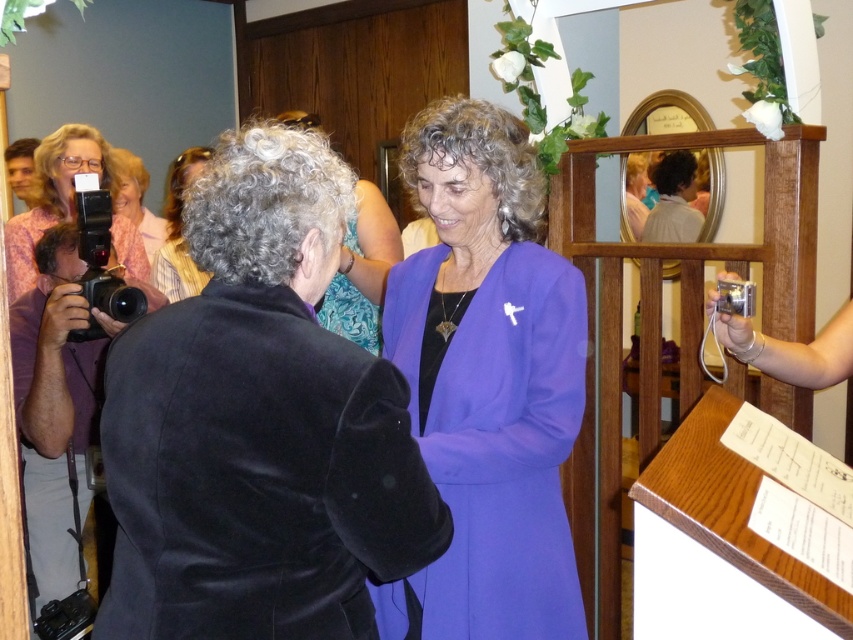
Based on the scene description, which object is positioned higher in the image between the curly hair at center and the matte purple dress at center?

The curly hair at center is much taller than the matte purple dress at center, so it is positioned higher in the image.